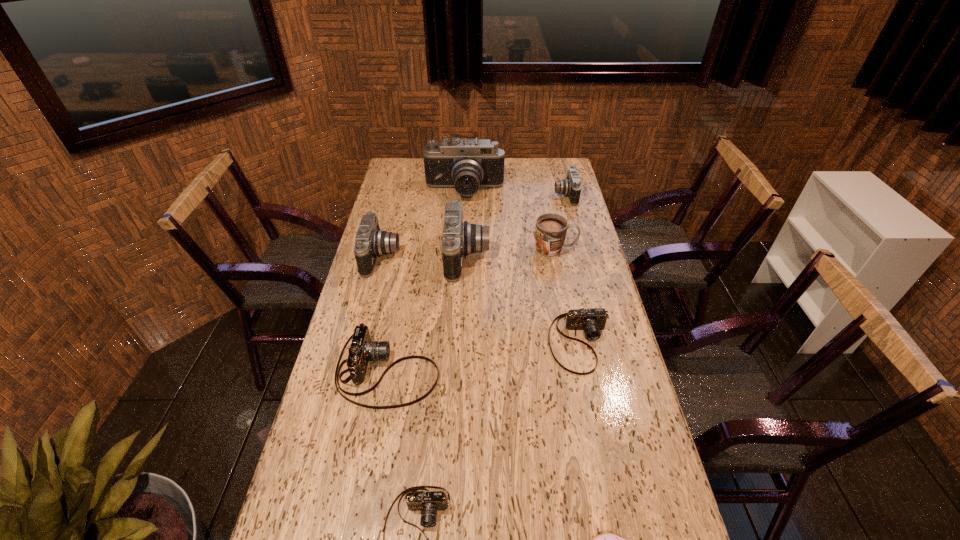
Where is `free space located 0.070m on the front-facing side of the fifth tallest camera`? Image resolution: width=960 pixels, height=540 pixels. free space located 0.070m on the front-facing side of the fifth tallest camera is located at coordinates pyautogui.click(x=463, y=372).

Find the location of `free space located on the front-facing side of the second shortest camera`. free space located on the front-facing side of the second shortest camera is located at coordinates (595, 416).

You are a GUI agent. You are given a task and a screenshot of the screen. Output one action in this format:
    pyautogui.click(x=<x>, y=<y>)
    Task: Click on the object that is at the far edge
    The image size is (960, 540).
    Given the screenshot: What is the action you would take?
    pyautogui.click(x=466, y=165)

At what (x,y) coordinates should I click in order to perform the action: click on mug that is positioned at the right edge. Please return your answer as a coordinate pair (x, y). The width and height of the screenshot is (960, 540). Looking at the image, I should click on (550, 232).

In order to click on free space at the far edge of the desktop in this screenshot , I will do `click(533, 165)`.

Where is `vacant region at the left edge of the desktop`? vacant region at the left edge of the desktop is located at coordinates (392, 219).

In the image, there is a desktop. In order to click on blank space at the right edge in this screenshot , I will do `click(626, 382)`.

The image size is (960, 540). In order to click on empty space between the biggest black camera and the mug in this screenshot , I will do `click(510, 220)`.

Find the location of a particular element. This screenshot has height=540, width=960. unoccupied position between the leftmost black camera and the third smallest black camera is located at coordinates (424, 256).

Locate an element on the screen. The image size is (960, 540). free space between the sixth tallest object and the mug is located at coordinates (471, 310).